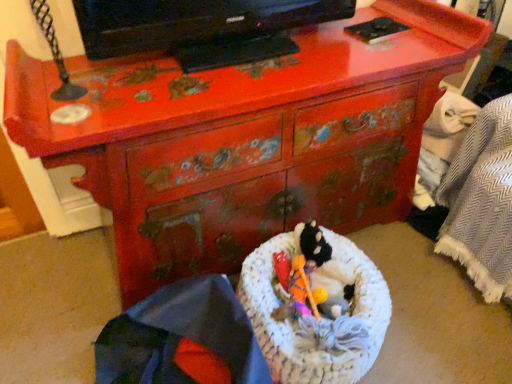
The height and width of the screenshot is (384, 512). Identify the location of woven fabric basket at lower center. (182, 338).

What do you see at coordinates (291, 325) in the screenshot?
I see `white knitted laundry basket at center` at bounding box center [291, 325].

Where is `woven fabric basket at lower center`? The height and width of the screenshot is (384, 512). woven fabric basket at lower center is located at coordinates (182, 338).

Is point (180, 365) positioned after point (383, 293)?

No, it is in front of (383, 293).

Consider the image. Considering the relative sizes of woven fabric basket at lower center and white knitted laundry basket at center in the image provided, is woven fabric basket at lower center taller than white knitted laundry basket at center?

Yes, woven fabric basket at lower center is taller than white knitted laundry basket at center.

Who is more distant, woven fabric basket at lower center or white knitted laundry basket at center?

white knitted laundry basket at center is more distant.

Would you say woven fabric basket at lower center contains white knitted laundry basket at center?

That's incorrect, white knitted laundry basket at center is not inside woven fabric basket at lower center.

From the image's perspective, would you say black glossy tv at upper center is shown under white knitted laundry basket at center?

Actually, black glossy tv at upper center appears above white knitted laundry basket at center in the image.

Between black glossy tv at upper center and white knitted laundry basket at center, which one has smaller size?

black glossy tv at upper center is smaller.

In the scene shown: From a real-world perspective, does black glossy tv at upper center sit lower than white knitted laundry basket at center?

Actually, black glossy tv at upper center is physically above white knitted laundry basket at center in the real world.

Based on the photo, which point is more distant from viewer, (x=380, y=322) or (x=148, y=18)?

The point (x=380, y=322) is more distant.

At what (x,y) coordinates should I click in order to perform the action: click on laundry basket on the right of black glossy tv at upper center. Please return your answer as a coordinate pair (x, y). This screenshot has height=384, width=512. Looking at the image, I should click on (291, 325).

Is black glossy tv at upper center completely or partially inside white knitted laundry basket at center?

No, black glossy tv at upper center is not surrounded by white knitted laundry basket at center.

From a real-world perspective, which is physically above, white knitted laundry basket at center or black glossy tv at upper center?

In real-world perspective, black glossy tv at upper center is above.

Does black glossy tv at upper center touch woven fabric basket at lower center?

No, black glossy tv at upper center is not with woven fabric basket at lower center.

Which is in front, black glossy tv at upper center or woven fabric basket at lower center?

woven fabric basket at lower center is in front.

Considering the relative positions of black glossy tv at upper center and woven fabric basket at lower center in the image provided, is black glossy tv at upper center to the left of woven fabric basket at lower center from the viewer's perspective?

In fact, black glossy tv at upper center is to the right of woven fabric basket at lower center.

Would you say woven fabric basket at lower center is part of black glossy tv at upper center's contents?

No, woven fabric basket at lower center is not surrounded by black glossy tv at upper center.

Could you tell me if white knitted laundry basket at center is turned towards woven fabric basket at lower center?

No, white knitted laundry basket at center is not oriented towards woven fabric basket at lower center.

Considering the relative positions of white knitted laundry basket at center and woven fabric basket at lower center in the image provided, is white knitted laundry basket at center to the left of woven fabric basket at lower center from the viewer's perspective?

No.

Who is shorter, white knitted laundry basket at center or woven fabric basket at lower center?

With less height is white knitted laundry basket at center.

Can you tell me how much white knitted laundry basket at center and woven fabric basket at lower center differ in facing direction?

They differ by 88.6 degrees in their facing directions.

Is woven fabric basket at lower center oriented towards black glossy tv at upper center?

No.

From a real-world perspective, relative to black glossy tv at upper center, is woven fabric basket at lower center vertically above or below?

woven fabric basket at lower center is below black glossy tv at upper center.

Is woven fabric basket at lower center inside the boundaries of black glossy tv at upper center, or outside?

woven fabric basket at lower center is outside black glossy tv at upper center.

Which object is more forward, woven fabric basket at lower center or black glossy tv at upper center?

woven fabric basket at lower center.

Image resolution: width=512 pixels, height=384 pixels. In order to click on laundry basket below the woven fabric basket at lower center (from a real-world perspective) in this screenshot , I will do `click(291, 325)`.

This screenshot has width=512, height=384. In order to click on television on the left of white knitted laundry basket at center in this screenshot , I will do `click(201, 28)`.

Estimate the real-world distances between objects in this image. Which object is closer to white knitted laundry basket at center, black glossy tv at upper center or woven fabric basket at lower center?

woven fabric basket at lower center.

Which object lies nearer to the anchor point woven fabric basket at lower center, black glossy tv at upper center or white knitted laundry basket at center?

white knitted laundry basket at center is closer to woven fabric basket at lower center.

Which object lies nearer to the anchor point black glossy tv at upper center, woven fabric basket at lower center or white knitted laundry basket at center?

white knitted laundry basket at center lies closer to black glossy tv at upper center than the other object.

Considering their positions, is woven fabric basket at lower center positioned further to white knitted laundry basket at center than black glossy tv at upper center?

black glossy tv at upper center.

When comparing their distances from black glossy tv at upper center, does white knitted laundry basket at center or woven fabric basket at lower center seem further?

The object further to black glossy tv at upper center is woven fabric basket at lower center.

From the image, which object appears to be nearer to woven fabric basket at lower center, white knitted laundry basket at center or black glossy tv at upper center?

white knitted laundry basket at center is closer to woven fabric basket at lower center.

I want to click on laundry basket between black glossy tv at upper center and woven fabric basket at lower center in the up-down direction, so [291, 325].